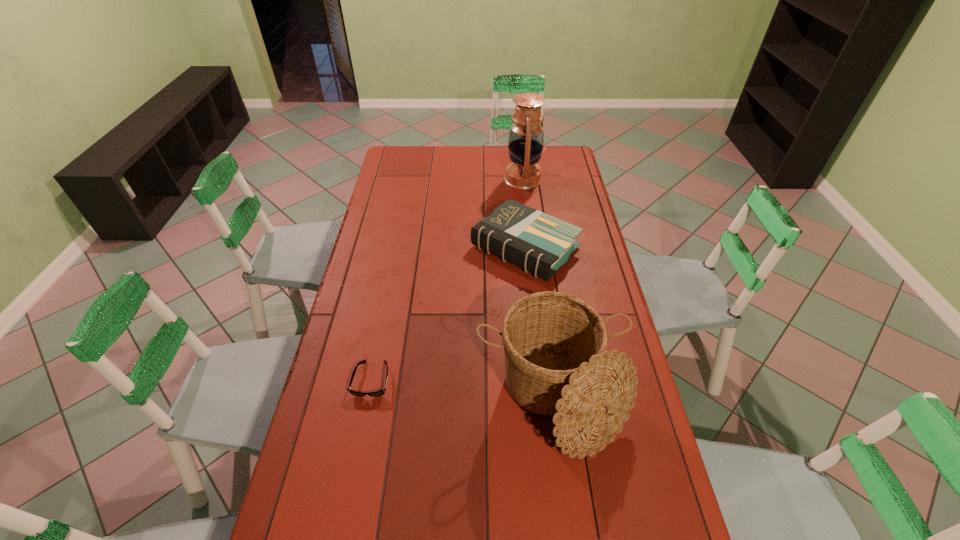
You are a GUI agent. You are given a task and a screenshot of the screen. Output one action in this format:
    pyautogui.click(x=<x>, y=<y>)
    Task: Click on the free spot between the farthest object and the second tallest object
    This screenshot has height=540, width=960.
    Given the screenshot: What is the action you would take?
    pyautogui.click(x=538, y=289)

Identify the location of free space between the basket and the tallest object. (538, 289).

Where is `free spot between the sunglasses and the tallest object`? This screenshot has height=540, width=960. free spot between the sunglasses and the tallest object is located at coordinates (447, 279).

Where is `free spot between the sunglasses and the second tallest object`? The height and width of the screenshot is (540, 960). free spot between the sunglasses and the second tallest object is located at coordinates (462, 389).

Where is `free space between the paperback book and the leftmost object`? The image size is (960, 540). free space between the paperback book and the leftmost object is located at coordinates (448, 314).

Where is `vacant area that lies between the second tallest object and the sunglasses`? This screenshot has width=960, height=540. vacant area that lies between the second tallest object and the sunglasses is located at coordinates (462, 389).

Point out which object is positioned as the third nearest to the basket. Please provide its 2D coordinates. Your answer should be formatted as a tuple, i.e. [(x, y)], where the tuple contains the x and y coordinates of a point satisfying the conditions above.

[(526, 137)]

Where is `the third closest object to the oil lamp`? Image resolution: width=960 pixels, height=540 pixels. the third closest object to the oil lamp is located at coordinates (378, 393).

Image resolution: width=960 pixels, height=540 pixels. Find the location of `vacant point that satisfies the following two spatial constraints: 1. on the front-facing side of the basket; 2. on the right side of the shortest object`. vacant point that satisfies the following two spatial constraints: 1. on the front-facing side of the basket; 2. on the right side of the shortest object is located at coordinates (368, 400).

Where is `vacant space that satisfies the following two spatial constraints: 1. on the front-facing side of the sunglasses; 2. on the right side of the basket`? The height and width of the screenshot is (540, 960). vacant space that satisfies the following two spatial constraints: 1. on the front-facing side of the sunglasses; 2. on the right side of the basket is located at coordinates tap(368, 400).